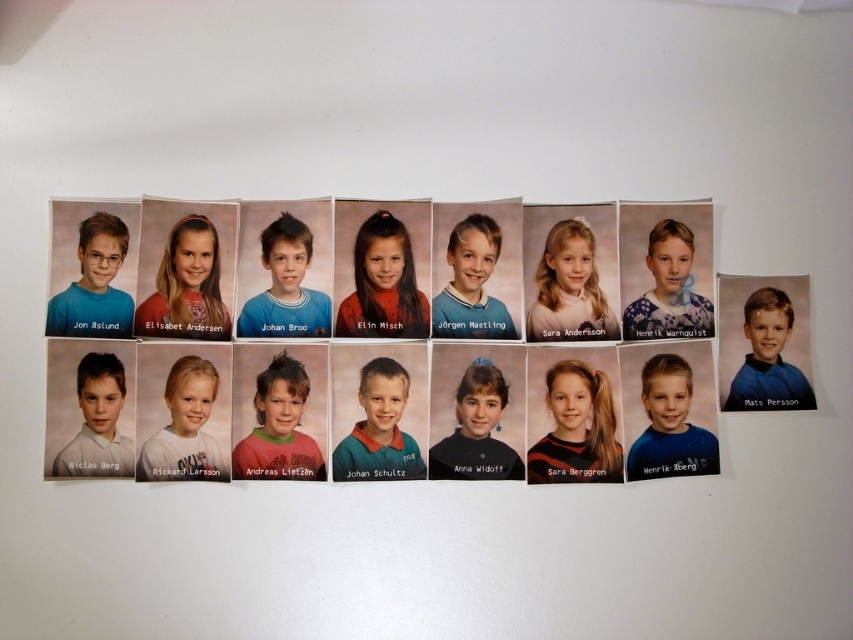
You are a photographer arranging portraits on a wall. You have two subjects in the center row of the image. One has a pink matte shirt at center and the other has light brown hair at center. Which subject should you adjust to ensure their clothing and hair details are equally visible to viewers standing directly in front of the wall?

The pink matte shirt at center is positioned over light brown hair at center, so you should adjust the light brown hair at center to ensure their clothing and hair details are equally visible.

You are standing in front of a wall with two points marked on it. The points are labeled as point 1 and point 2. Point 1 is at coordinates (241,476) and point 2 is at (204,470). According to the image, which point is closer to you?

Point 2 at (204,470) is closer to you because point 1 at (241,476) is behind it.